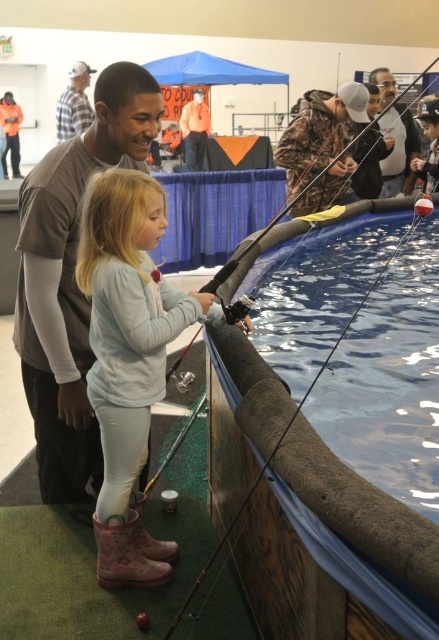
Between point (32, 416) and point (180, 115), which one is positioned behind?

Point (180, 115)

Is matte brown shirt at upper left thinner than orange shirt at upper center?

Incorrect, matte brown shirt at upper left's width is not less than orange shirt at upper center's.

Which is behind, point (74, 324) or point (193, 147)?

The point (193, 147) is more distant.

Find the location of a particular element. matte brown shirt at upper left is located at coordinates (71, 278).

Who is lower down, wooden fishing rod at center or orange shirt at upper center?

wooden fishing rod at center is below.

Is point (403, 241) in front of point (201, 99)?

Yes, point (403, 241) is in front of point (201, 99).

Identify the location of wooden fishing rod at center. (298, 412).

Is point (143, 148) positioned behind point (417, 147)?

No, (143, 148) is closer to viewer.

This screenshot has height=640, width=439. What do you see at coordinates (71, 278) in the screenshot? I see `matte brown shirt at upper left` at bounding box center [71, 278].

Where is `matte brown shirt at upper left`? The height and width of the screenshot is (640, 439). matte brown shirt at upper left is located at coordinates (71, 278).